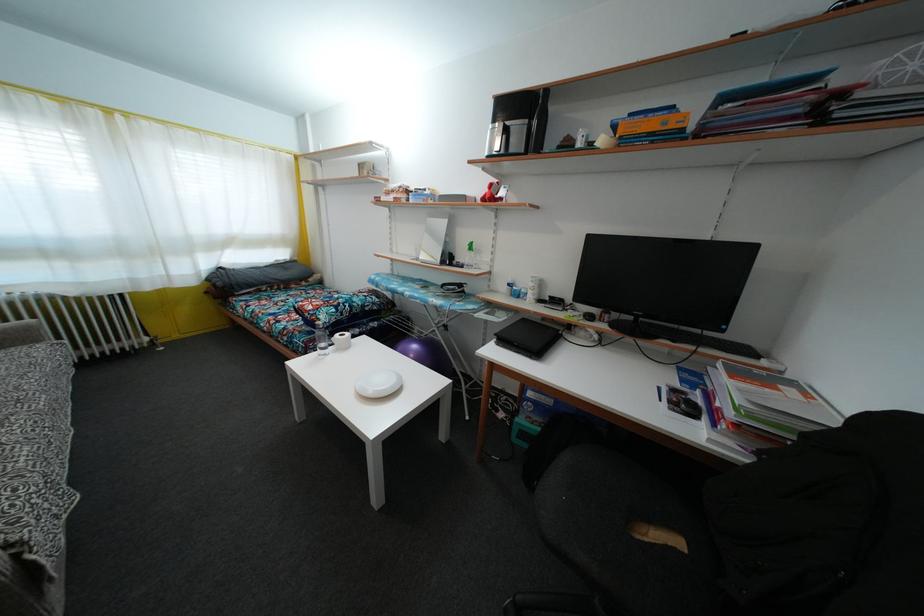
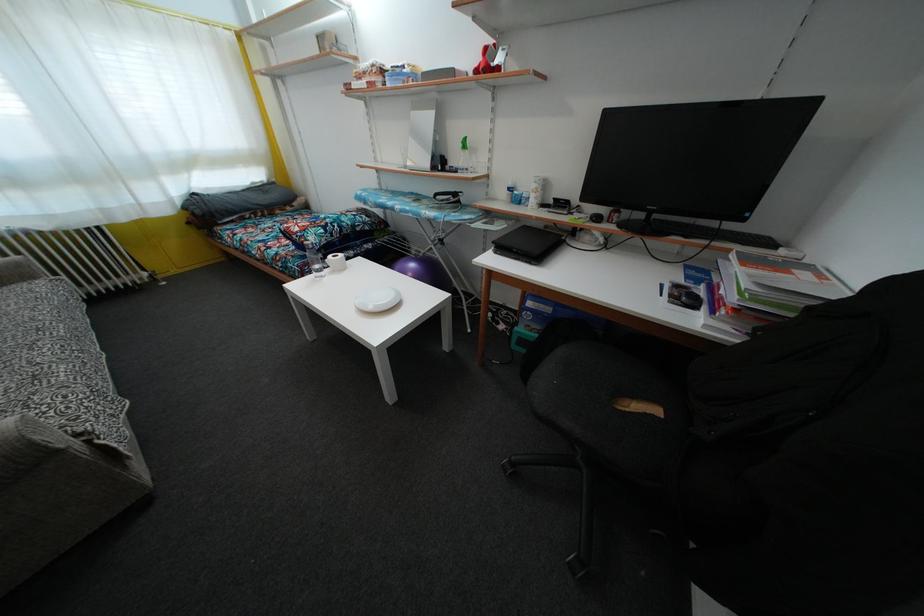
Find the pixel in the second image that matches (350,341) in the first image.

(345, 262)